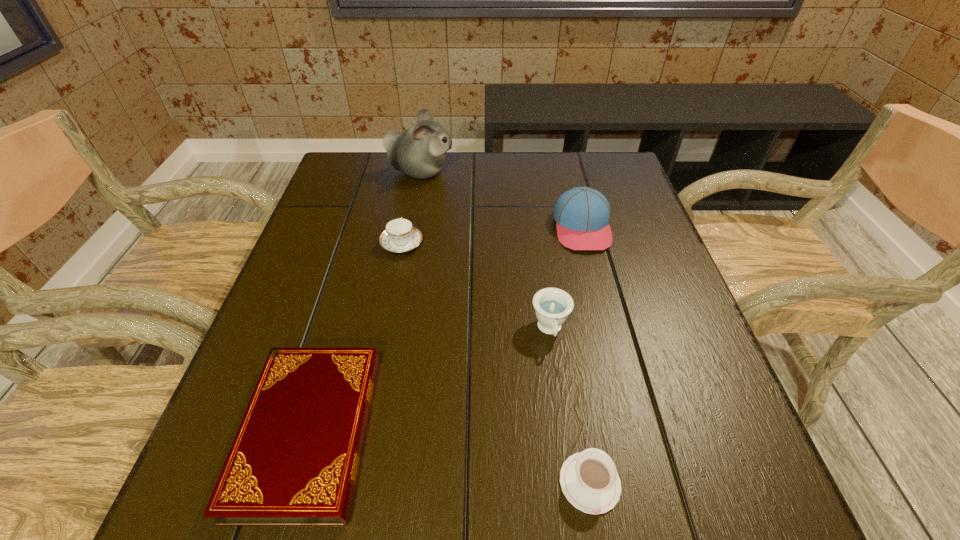
The image size is (960, 540). Identify the location of vacant space situated 0.050m on the side of the tallest teacup with the handle. (556, 373).

This screenshot has width=960, height=540. Find the location of `vacant space located 0.170m on the side with the handle of the leftmost teacup`. vacant space located 0.170m on the side with the handle of the leftmost teacup is located at coordinates (412, 192).

Where is `vacant space located on the side with the handle of the leftmost teacup`? This screenshot has height=540, width=960. vacant space located on the side with the handle of the leftmost teacup is located at coordinates (414, 180).

Find the location of `free spot located 0.270m on the side with the handle of the leftmost teacup`. free spot located 0.270m on the side with the handle of the leftmost teacup is located at coordinates (416, 172).

Find the location of a particular element. This screenshot has width=960, height=540. vacant space located 0.230m on the handle side of the nearest teacup is located at coordinates (565, 338).

Locate an element on the screen. vacant point located on the handle side of the nearest teacup is located at coordinates (569, 363).

Locate an element on the screen. vacant space located 0.380m on the handle side of the nearest teacup is located at coordinates (556, 283).

The height and width of the screenshot is (540, 960). What are the coordinates of `object at the far edge` in the screenshot? It's located at (420, 152).

I want to click on teacup that is at the near edge, so click(589, 480).

The image size is (960, 540). In order to click on hardback book at the near edge in this screenshot , I will do `click(294, 461)`.